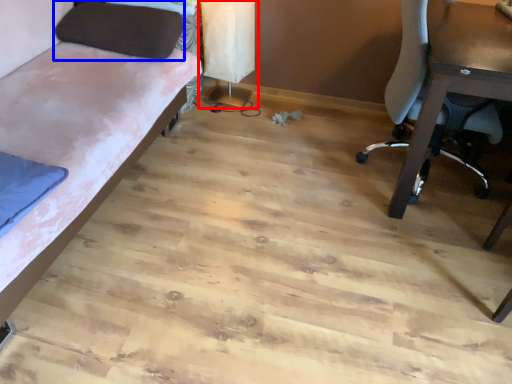
Question: Which point is closer to the camera, table lamp (highlighted by a red box) or pillow (highlighted by a blue box)?

Choices:
 (A) table lamp
 (B) pillow

Answer: (B)